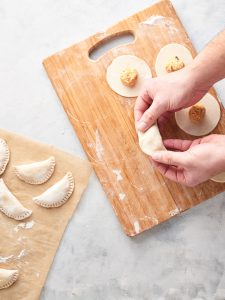
Locate an element on the screen. This screenshot has width=225, height=300. stone countertop is located at coordinates (96, 256), (54, 125).